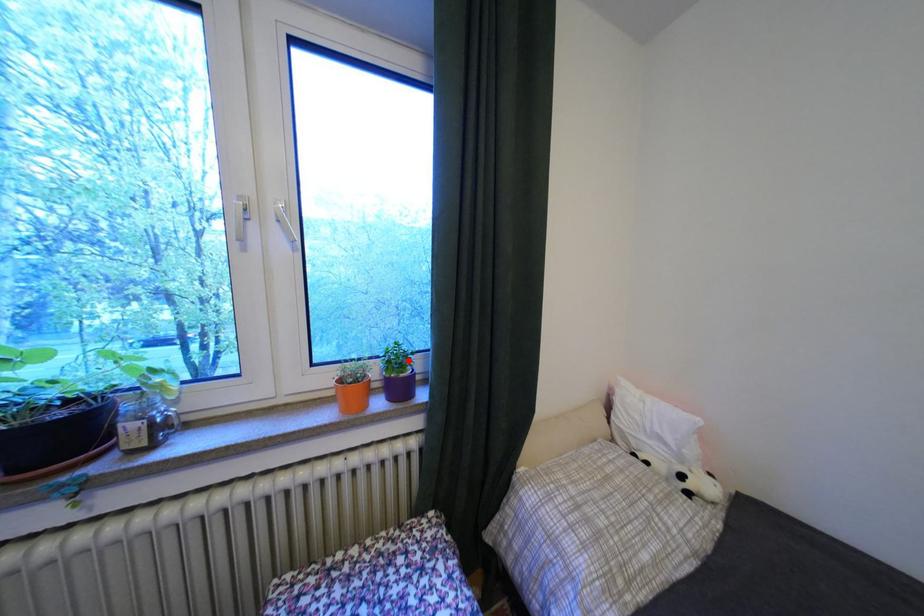
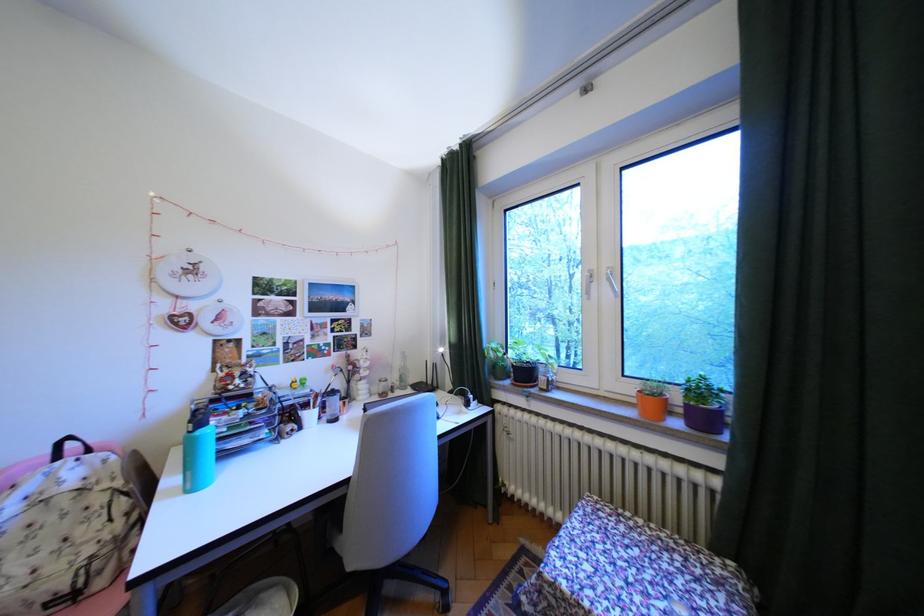
Find the pixel in the second image that matches the highlighted location in the first image.

(710, 391)